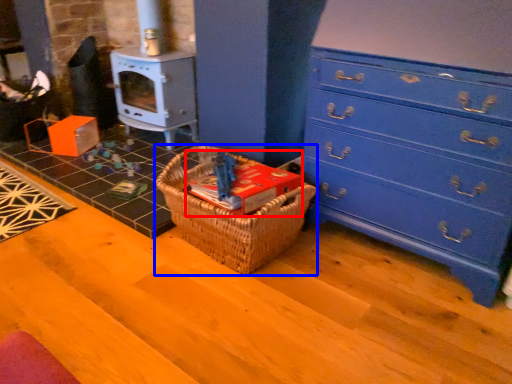
Question: Which object is further to the camera taking this photo, book (highlighted by a red box) or picnic basket (highlighted by a blue box)?

Choices:
 (A) book
 (B) picnic basket

Answer: (A)